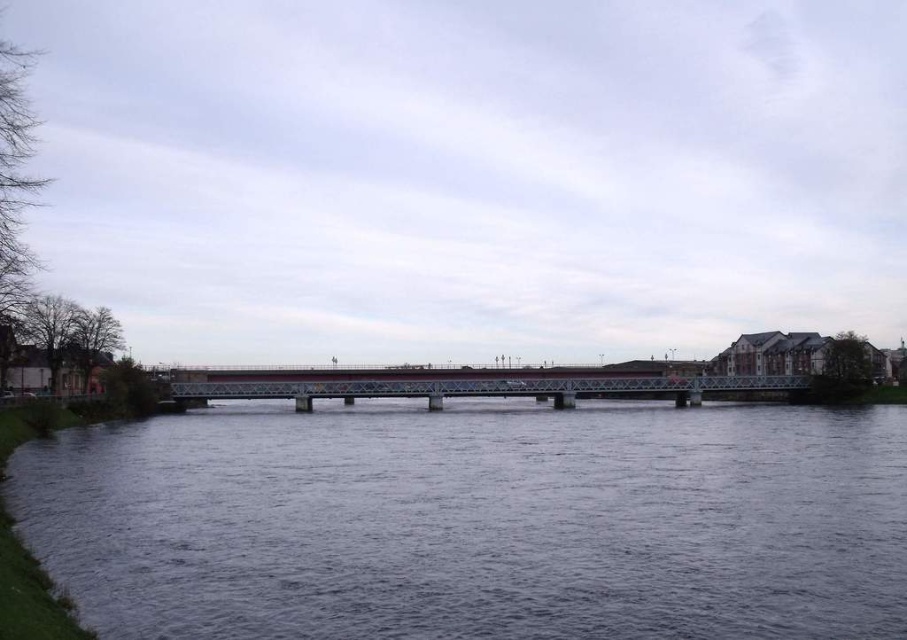
Is dark gray water at center smaller than metallic bridge at center?

Indeed, dark gray water at center has a smaller size compared to metallic bridge at center.

Who is positioned more to the left, dark gray water at center or metallic bridge at center?

metallic bridge at center

Which is behind, point (806, 502) or point (618, 392)?

The point (618, 392) is behind.

The height and width of the screenshot is (640, 907). What are the coordinates of `dark gray water at center` in the screenshot? It's located at (476, 522).